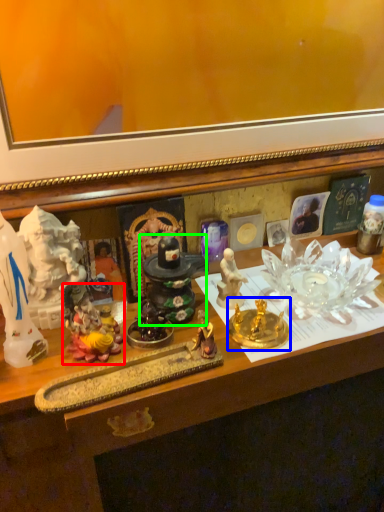
Question: Based on their relative distances, which object is farther from toy (highlighted by a red box)? Choose from candle holder (highlighted by a blue box) and toy (highlighted by a green box).

Choices:
 (A) candle holder
 (B) toy

Answer: (A)